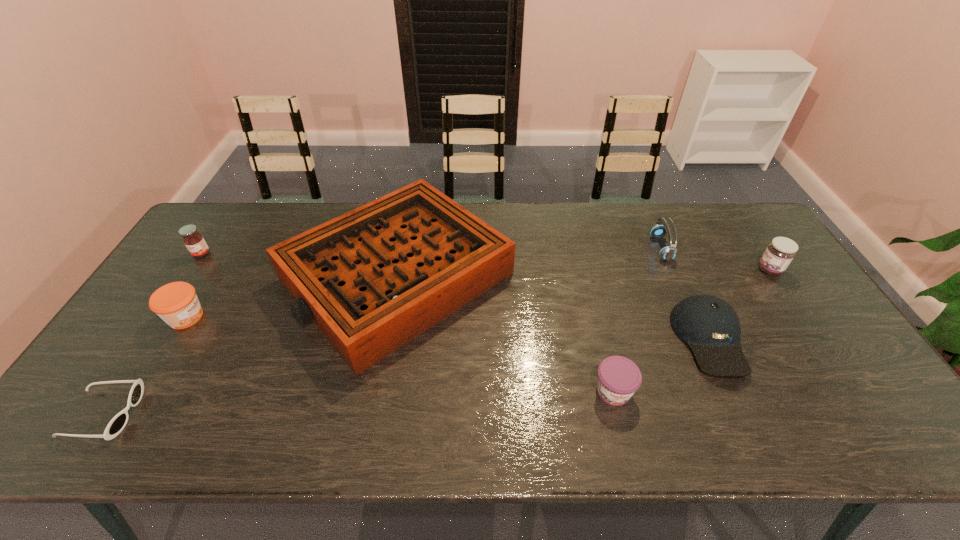
You are a GUI agent. You are given a task and a screenshot of the screen. Output one action in this format:
    pyautogui.click(x=<x>, y=<y>)
    Task: Click on the vacant space located on the right of the gameboard
    Image resolution: width=960 pixels, height=540 pixels.
    Given the screenshot: What is the action you would take?
    pyautogui.click(x=579, y=276)

Where is `free location located 0.160m on the front label of the third nearest jam`? free location located 0.160m on the front label of the third nearest jam is located at coordinates (706, 270).

Find the location of `free spot located 0.250m on the front label of the third nearest jam`. free spot located 0.250m on the front label of the third nearest jam is located at coordinates (677, 270).

Find the location of `vacant point located on the front label of the third nearest jam`. vacant point located on the front label of the third nearest jam is located at coordinates (663, 270).

This screenshot has width=960, height=540. I want to click on free space located on the ear cups of the headset, so click(x=548, y=248).

Where is `free spot located on the ear cups of the headset`? free spot located on the ear cups of the headset is located at coordinates [616, 248].

The image size is (960, 540). I want to click on vacant space located on the ear cups of the headset, so click(x=539, y=248).

The width and height of the screenshot is (960, 540). I want to click on vacant region located 0.240m on the label side of the farthest jam, so click(158, 319).

The width and height of the screenshot is (960, 540). I want to click on free spot located 0.110m on the front-facing side of the baseball cap, so click(x=748, y=426).

The image size is (960, 540). Find the location of `vacant space located on the front label of the second nearest jam`. vacant space located on the front label of the second nearest jam is located at coordinates (234, 317).